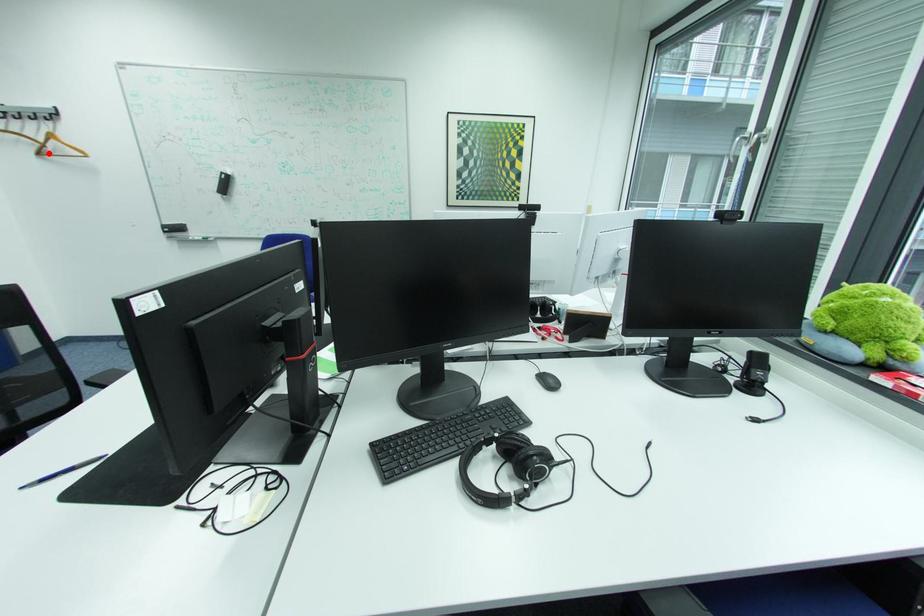
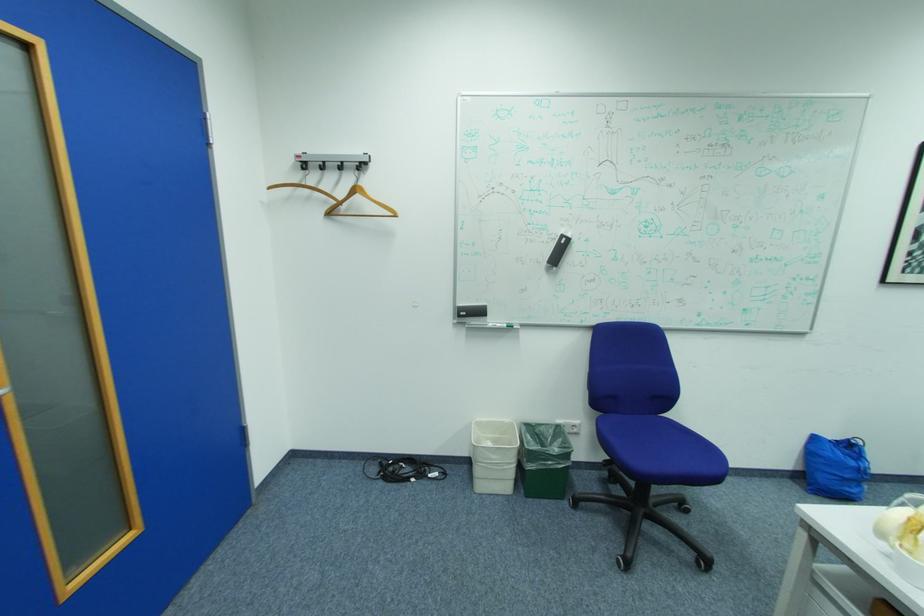
Question: I am providing you with two images of the same scene from different viewpoints. Image1 has a red point marked. In image2, the corresponding 3D location appears at what relative position? Reply with the corresponding letter.

Choices:
 (A) Closer
 (B) Farther

Answer: (A)